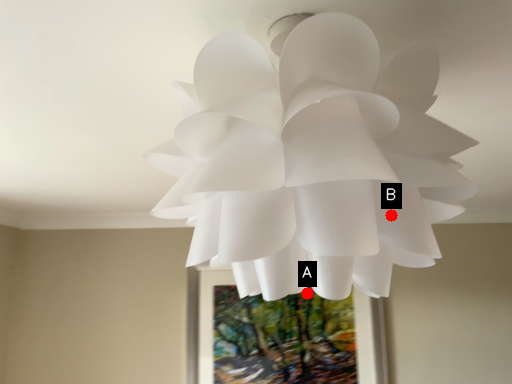
Question: Two points are circled on the image, labeled by A and B beside each circle. Which point is farther to the camera?

Choices:
 (A) A is further
 (B) B is further

Answer: (A)